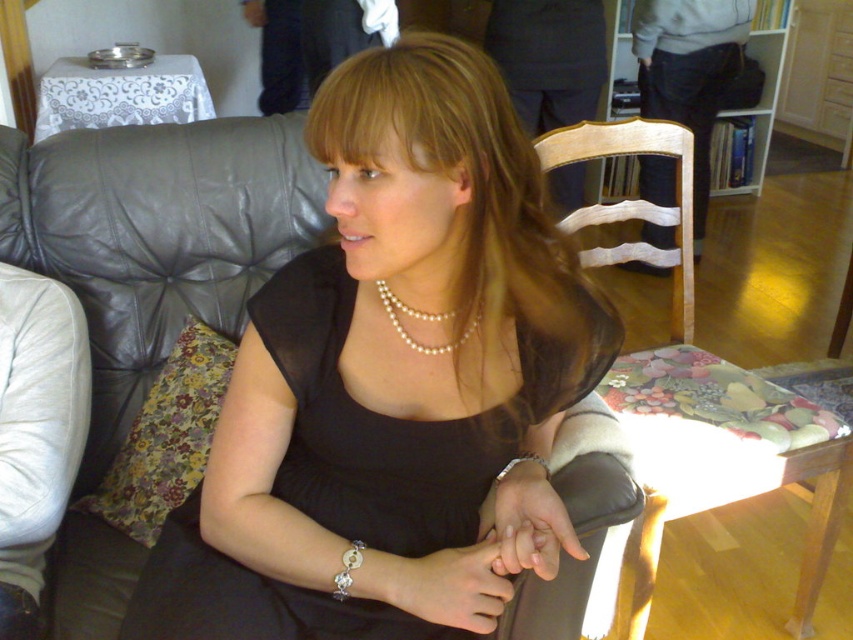
Which is above, wooden chair at right or smooth skin hand at center?

Positioned higher is wooden chair at right.

Does wooden chair at right come behind smooth skin hand at center?

Yes, wooden chair at right is further from the viewer.

The image size is (853, 640). What do you see at coordinates (694, 394) in the screenshot? I see `wooden chair at right` at bounding box center [694, 394].

The width and height of the screenshot is (853, 640). In order to click on wooden chair at right in this screenshot , I will do `click(694, 394)`.

Image resolution: width=853 pixels, height=640 pixels. What do you see at coordinates (527, 524) in the screenshot?
I see `smooth skin hand at center` at bounding box center [527, 524].

Is smooth skin hand at center further to camera compared to dark gray suit jacket at upper center?

No, it is in front of dark gray suit jacket at upper center.

What do you see at coordinates (527, 524) in the screenshot? Image resolution: width=853 pixels, height=640 pixels. I see `smooth skin hand at center` at bounding box center [527, 524].

The image size is (853, 640). In order to click on smooth skin hand at center in this screenshot , I will do `click(527, 524)`.

Can you confirm if black sheer dress at center is positioned above pearl necklace at center?

No.

Does black sheer dress at center have a lesser height compared to pearl necklace at center?

In fact, black sheer dress at center may be taller than pearl necklace at center.

Between point (555, 365) and point (386, 296), which one is positioned in front?

Point (386, 296) is more forward.

I want to click on black sheer dress at center, so (x=398, y=419).